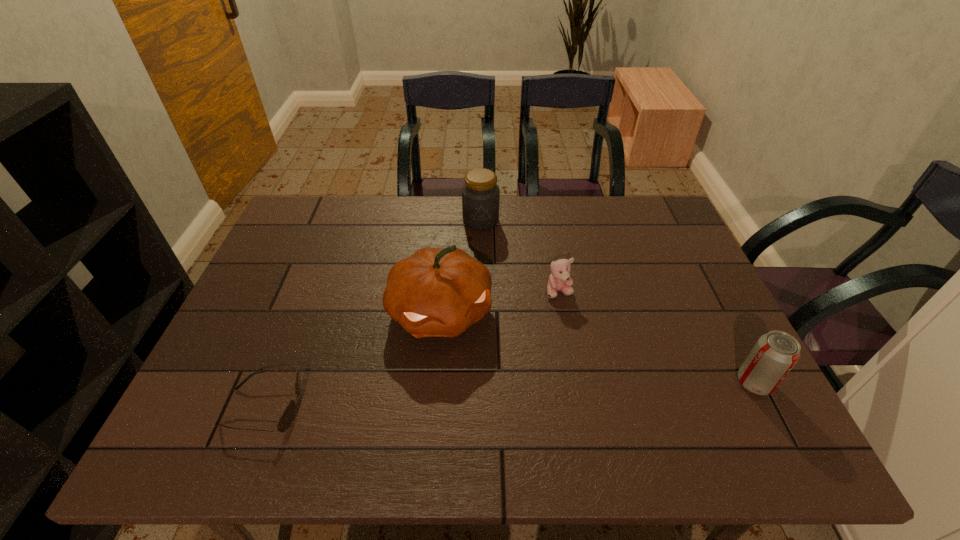
The width and height of the screenshot is (960, 540). I want to click on vacant space that satisfies the following two spatial constraints: 1. on the front side of the third tallest object; 2. on the left side of the teddy bear, so click(x=576, y=382).